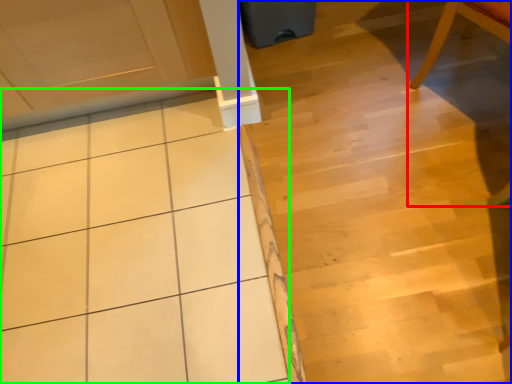
Question: Which object is the farthest from chair (highlighted by a red box)? Choose among these: stair (highlighted by a blue box) or ceramic tile (highlighted by a green box).

Choices:
 (A) stair
 (B) ceramic tile

Answer: (B)